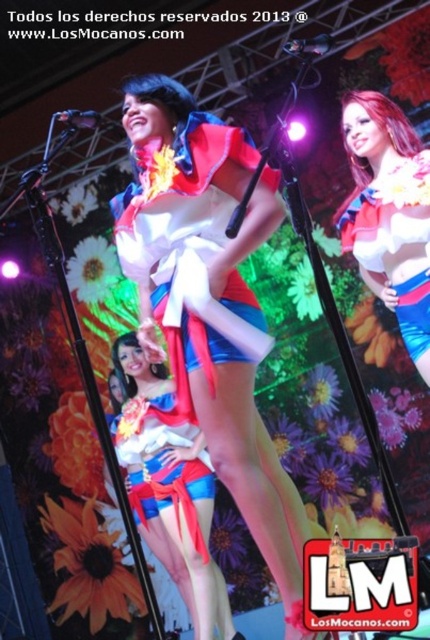
Based on the coordinates provided in the scene description, where exactly is the shiny satin skirt at center located?

The shiny satin skirt at center is located at point coordinates of 0.381 on the x axis and 0.921 on the y axis.

You are a stagehand responsible for setting up the stage. You need to place a new decorative banner that is 1.2 meters wide between the shiny satin skirt at center and the metallic silver microphone at center. Based on their sizes, will the banner fit between them?

The shiny satin skirt at center is wider than the metallic silver microphone at center. Since the banner is 1.2 meters wide, it depends on the actual widths of the skirt and microphone. However, the description only states the skirt is wider, not the exact measurements. Therefore, we cannot definitively determine if the banner will fit without more specific size information.